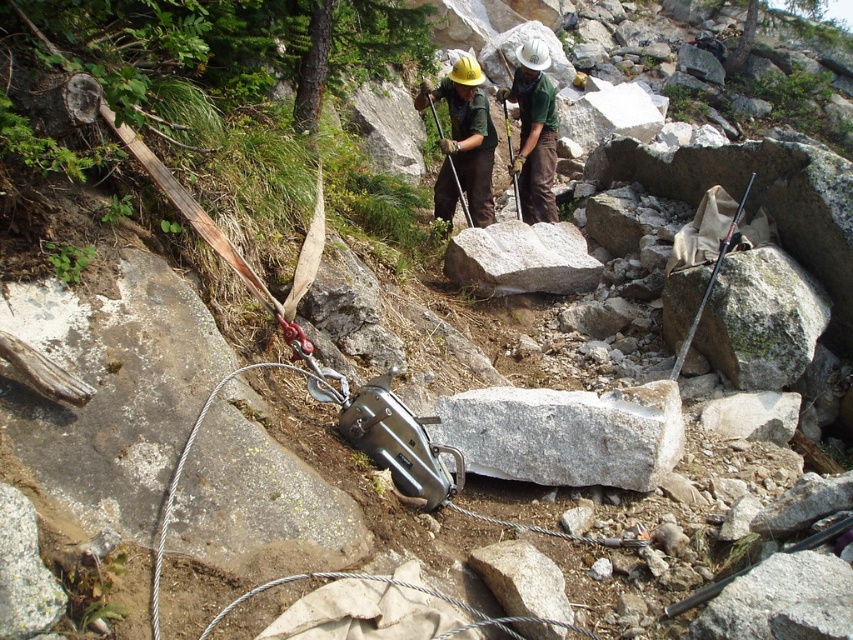
Question: Among these points, which one is nearest to the camera?

Choices:
 (A) [607, 410]
 (B) [543, 188]
 (C) [727, 237]

Answer: (A)

Question: Is green matte shirt at center closer to camera compared to black rubber hose at lower right?

Choices:
 (A) yes
 (B) no

Answer: (B)

Question: Observing the image, what is the correct spatial positioning of black rubber hose at lower right in reference to metallic silver tool at center?

Choices:
 (A) above
 (B) below

Answer: (B)

Question: Which of the following is the farthest from the observer?

Choices:
 (A) (762, 342)
 (B) (518, 208)

Answer: (B)

Question: In this image, where is matte black tool at center located relative to metallic silver tool at center?

Choices:
 (A) above
 (B) below

Answer: (B)

Question: Which object appears farthest from the camera in this image?

Choices:
 (A) white granite block at center
 (B) metallic silver tool at center

Answer: (B)